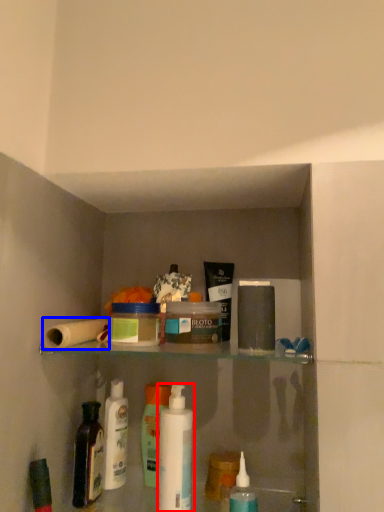
Question: Which point is closer to the camera, mouthwash (highlighted by a red box) or toilet paper (highlighted by a blue box)?

Choices:
 (A) mouthwash
 (B) toilet paper

Answer: (B)